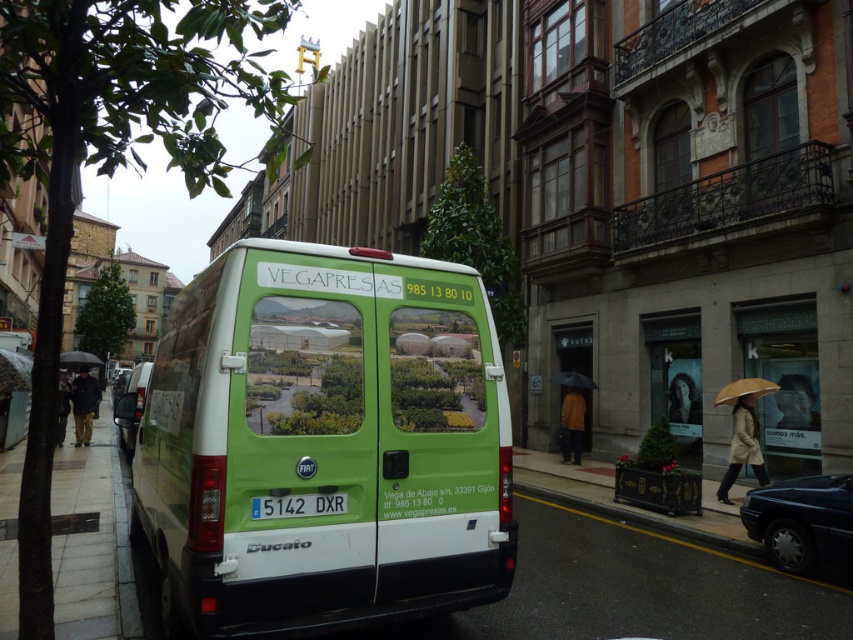
Question: Which object appears closest to the camera in this image?

Choices:
 (A) dark brown leather coat at lower left
 (B) dark brown leather jacket at lower left
 (C) brown matte umbrella at center-right

Answer: (A)

Question: Which point is farther from the camera taking this photo?

Choices:
 (A) (602, 515)
 (B) (84, 388)
 (C) (570, 380)

Answer: (B)

Question: Is dark brown leather coat at lower left smaller than black matte umbrella at center?

Choices:
 (A) yes
 (B) no

Answer: (B)

Question: Considering the relative positions of white plastic license plate at center and black matte umbrella at center in the image provided, where is white plastic license plate at center located with respect to black matte umbrella at center?

Choices:
 (A) above
 (B) below

Answer: (A)

Question: Which object appears closest to the camera in this image?

Choices:
 (A) brown leather jacket at center
 (B) white matte van at center

Answer: (B)

Question: Does shiny dark blue sedan at lower right have a lesser width compared to matte black umbrella at left?

Choices:
 (A) no
 (B) yes

Answer: (B)